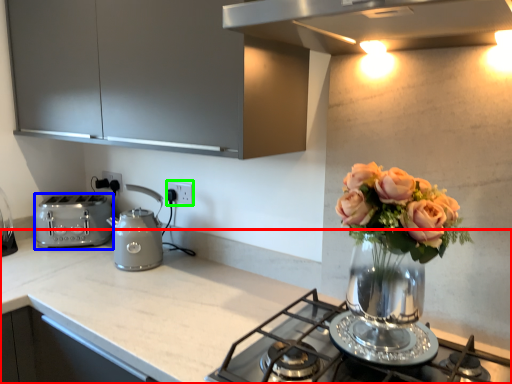
Question: Which object is the farthest from countertop (highlighted by a red box)? Choose among these: toaster (highlighted by a blue box) or electric outlet (highlighted by a green box).

Choices:
 (A) toaster
 (B) electric outlet

Answer: (B)